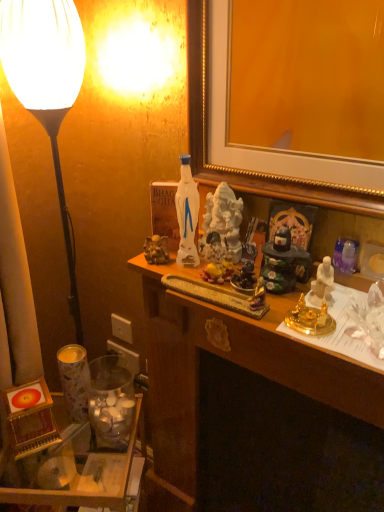
At what (x,y) coordinates should I click in order to perform the action: click on white matte lamp at left. Please return your answer as a coordinate pair (x, y). The width and height of the screenshot is (384, 512). Looking at the image, I should click on (46, 83).

Where is `white plastic power outlet at lower left, the first power outlet positioned from the bottom`? This screenshot has height=512, width=384. white plastic power outlet at lower left, the first power outlet positioned from the bottom is located at coordinates (125, 357).

From the image's perspective, relative to translucent glass jar at lower left, is white plastic power outlet at lower left, the first power outlet positioned from the bottom, above or below?

white plastic power outlet at lower left, the first power outlet positioned from the bottom, is situated higher than translucent glass jar at lower left in the image.

Are white plastic power outlet at lower left, the first power outlet positioned from the bottom, and translucent glass jar at lower left located far from each other?

That's not correct — white plastic power outlet at lower left, the first power outlet positioned from the bottom, is a little close to translucent glass jar at lower left.

How different are the orientations of white plastic power outlet at lower left, arranged as the 2th power outlet when viewed from the top, and translucent glass jar at lower left in degrees?

The facing directions of white plastic power outlet at lower left, arranged as the 2th power outlet when viewed from the top, and translucent glass jar at lower left are 35.2 degrees apart.

Consider the image. Considering the sizes of white plastic power outlet at lower left, the first power outlet positioned from the bottom, and translucent glass jar at lower left in the image, is white plastic power outlet at lower left, the first power outlet positioned from the bottom, bigger or smaller than translucent glass jar at lower left?

Clearly, white plastic power outlet at lower left, the first power outlet positioned from the bottom, is smaller in size than translucent glass jar at lower left.

Is beige plastic power outlet at lower left, which appears as the first power outlet when viewed from the top, aimed at translucent glass jar at lower left?

No, beige plastic power outlet at lower left, which appears as the first power outlet when viewed from the top, is not aimed at translucent glass jar at lower left.

Is beige plastic power outlet at lower left, which is the 2th power outlet from bottom to top, far from translucent glass jar at lower left?

beige plastic power outlet at lower left, which is the 2th power outlet from bottom to top, is actually quite close to translucent glass jar at lower left.

From their relative heights in the image, would you say beige plastic power outlet at lower left, which appears as the first power outlet when viewed from the top, is taller or shorter than translucent glass jar at lower left?

Considering their sizes, beige plastic power outlet at lower left, which appears as the first power outlet when viewed from the top, has less height than translucent glass jar at lower left.

Looking at this image, from a real-world perspective, between wooden desk at center and beige plastic power outlet at lower left, which is the 2th power outlet from bottom to top, who is vertically higher?

In real-world perspective, beige plastic power outlet at lower left, which is the 2th power outlet from bottom to top, is above.

Between wooden desk at center and beige plastic power outlet at lower left, which appears as the first power outlet when viewed from the top, which one appears on the left side from the viewer's perspective?

From the viewer's perspective, beige plastic power outlet at lower left, which appears as the first power outlet when viewed from the top, appears more on the left side.

Who is shorter, wooden desk at center or beige plastic power outlet at lower left, which appears as the first power outlet when viewed from the top?

beige plastic power outlet at lower left, which appears as the first power outlet when viewed from the top.

Is wooden desk at center wider than beige plastic power outlet at lower left, which is the 2th power outlet from bottom to top?

Indeed, wooden desk at center has a greater width compared to beige plastic power outlet at lower left, which is the 2th power outlet from bottom to top.

Considering the relative positions of white matte lamp at left and beige plastic power outlet at lower left, which is the 2th power outlet from bottom to top, in the image provided, is white matte lamp at left to the right of beige plastic power outlet at lower left, which is the 2th power outlet from bottom to top, from the viewer's perspective?

No.

You are a GUI agent. You are given a task and a screenshot of the screen. Output one action in this format:
    pyautogui.click(x=<x>, y=<y>)
    Task: Click on the lamp to the left of beige plastic power outlet at lower left, which appears as the first power outlet when viewed from the top
    This screenshot has height=512, width=384.
    Given the screenshot: What is the action you would take?
    pyautogui.click(x=46, y=83)

Is white matte lamp at left placed right next to beige plastic power outlet at lower left, which appears as the first power outlet when viewed from the top?

white matte lamp at left and beige plastic power outlet at lower left, which appears as the first power outlet when viewed from the top, are not in contact.

Considering the relative sizes of white matte lamp at left and beige plastic power outlet at lower left, which is the 2th power outlet from bottom to top, in the image provided, is white matte lamp at left shorter than beige plastic power outlet at lower left, which is the 2th power outlet from bottom to top,?

In fact, white matte lamp at left may be taller than beige plastic power outlet at lower left, which is the 2th power outlet from bottom to top.

Which is nearer, (372, 490) or (120, 434)?

Point (372, 490) is positioned closer to the camera compared to point (120, 434).

Which of these two, wooden desk at center or translucent glass jar at lower left, stands shorter?

With less height is translucent glass jar at lower left.

Measure the distance from wooden desk at center to translucent glass jar at lower left.

They are 14.11 inches apart.

From the image's perspective, relative to translucent glass jar at lower left, is wooden desk at center above or below?

Clearly, from the image's perspective, wooden desk at center is below translucent glass jar at lower left.

From the picture: From a real-world perspective, between white matte lamp at left and translucent glass jar at lower left, who is vertically higher?

white matte lamp at left.

In terms of width, does white matte lamp at left look wider or thinner when compared to translucent glass jar at lower left?

white matte lamp at left is thinner than translucent glass jar at lower left.

Is white matte lamp at left beside translucent glass jar at lower left?

No, white matte lamp at left is not making contact with translucent glass jar at lower left.

Is white matte lamp at left far away from translucent glass jar at lower left?

Actually, white matte lamp at left and translucent glass jar at lower left are a little close together.

Is white matte lamp at left facing away from translucent glass jar at lower left?

No, white matte lamp at left's orientation is not away from translucent glass jar at lower left.

In the scene shown: Does white matte lamp at left appear on the right side of translucent glass jar at lower left?

No.

Locate an element on the screen. The height and width of the screenshot is (512, 384). table in front of the white plastic power outlet at lower left, arranged as the 2th power outlet when viewed from the top is located at coordinates (88, 479).

Which power outlet is the 2nd one when counting from the right side of the translucent glass jar at lower left? Please provide its 2D coordinates.

[(121, 328)]

Considering their positions, is translucent glass jar at lower left positioned closer to white matte lamp at left than white plastic power outlet at lower left, the first power outlet positioned from the bottom?

white plastic power outlet at lower left, the first power outlet positioned from the bottom, is closer to white matte lamp at left.

When comparing their distances from white matte lamp at left, does beige plastic power outlet at lower left, which appears as the first power outlet when viewed from the top, or white plastic power outlet at lower left, the first power outlet positioned from the bottom, seem closer?

beige plastic power outlet at lower left, which appears as the first power outlet when viewed from the top, lies closer to white matte lamp at left than the other object.

Looking at this image, estimate the real-world distances between objects in this image. Which object is further from white matte lamp at left, wooden desk at center or beige plastic power outlet at lower left, which appears as the first power outlet when viewed from the top?

Based on the image, wooden desk at center appears to be further to white matte lamp at left.

Considering their positions, is translucent glass jar at lower left positioned closer to beige plastic power outlet at lower left, which is the 2th power outlet from bottom to top, than white matte lamp at left?

The object closer to beige plastic power outlet at lower left, which is the 2th power outlet from bottom to top, is translucent glass jar at lower left.

From the image, which object appears to be nearer to translucent glass jar at lower left, white plastic power outlet at lower left, arranged as the 2th power outlet when viewed from the top, or white matte lamp at left?

Among the two, white plastic power outlet at lower left, arranged as the 2th power outlet when viewed from the top, is located nearer to translucent glass jar at lower left.

Considering their positions, is beige plastic power outlet at lower left, which is the 2th power outlet from bottom to top, positioned closer to white plastic power outlet at lower left, arranged as the 2th power outlet when viewed from the top, than white matte lamp at left?

beige plastic power outlet at lower left, which is the 2th power outlet from bottom to top, lies closer to white plastic power outlet at lower left, arranged as the 2th power outlet when viewed from the top, than the other object.

From the image, which object appears to be farther from white matte lamp at left, beige plastic power outlet at lower left, which appears as the first power outlet when viewed from the top, or wooden desk at center?

wooden desk at center is positioned further to the anchor white matte lamp at left.

In the scene shown: Which object lies nearer to the anchor point white matte lamp at left, beige plastic power outlet at lower left, which appears as the first power outlet when viewed from the top, or translucent glass jar at lower left?

beige plastic power outlet at lower left, which appears as the first power outlet when viewed from the top.

At what (x,y) coordinates should I click in order to perform the action: click on power outlet between beige plastic power outlet at lower left, which appears as the first power outlet when viewed from the top, and translucent glass jar at lower left in the up-down direction. Please return your answer as a coordinate pair (x, y). The width and height of the screenshot is (384, 512). Looking at the image, I should click on (125, 357).

Identify the location of candle holder located between white matte lamp at left and white plastic power outlet at lower left, the first power outlet positioned from the bottom, in the depth direction. The width and height of the screenshot is (384, 512). (111, 403).

I want to click on candle holder between wooden desk at center and white plastic power outlet at lower left, arranged as the 2th power outlet when viewed from the top, from front to back, so click(111, 403).

I want to click on candle holder between white matte lamp at left and translucent glass jar at lower left vertically, so click(111, 403).